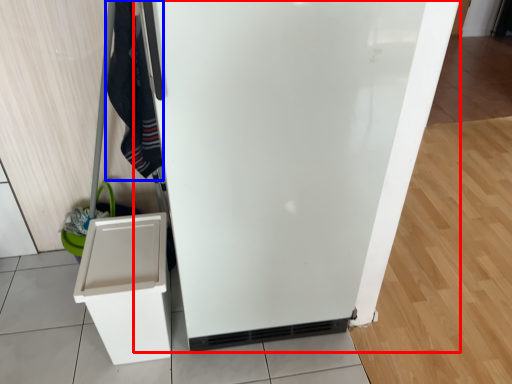
Question: Which of the following is the closest to the observer, refrigerator (highlighted by a red box) or clothing (highlighted by a blue box)?

Choices:
 (A) refrigerator
 (B) clothing

Answer: (A)